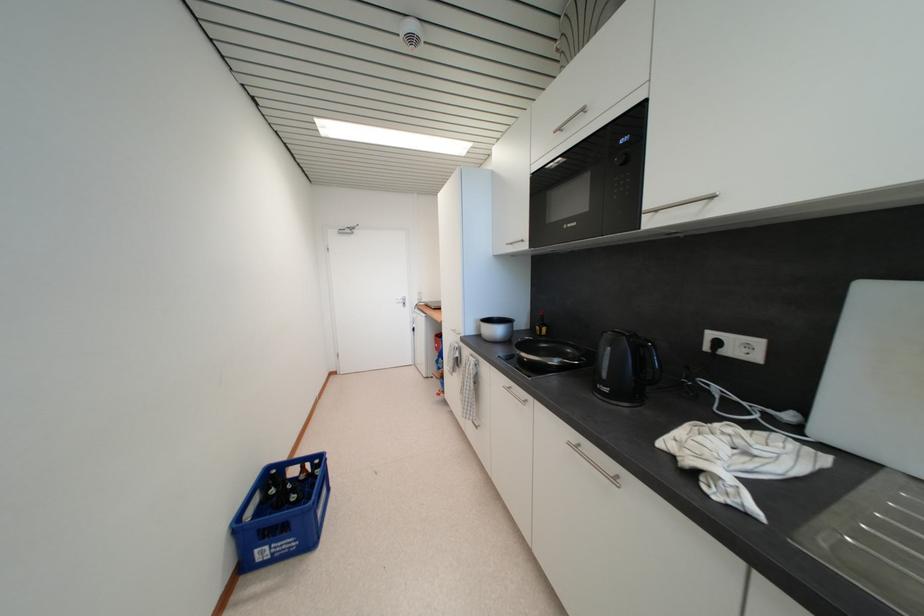
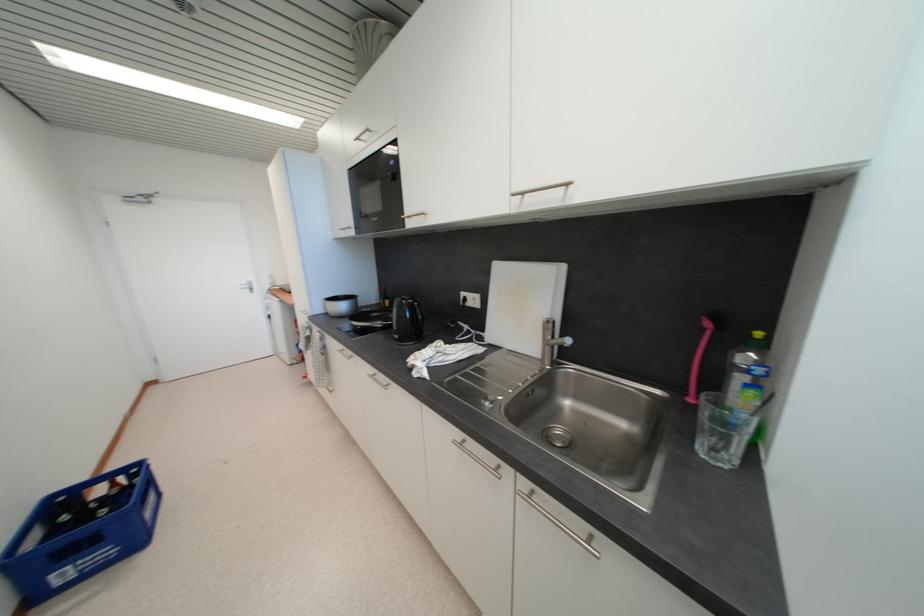
The point at [612,392] is marked in the first image. Where is the corresponding point in the second image?

(402, 339)